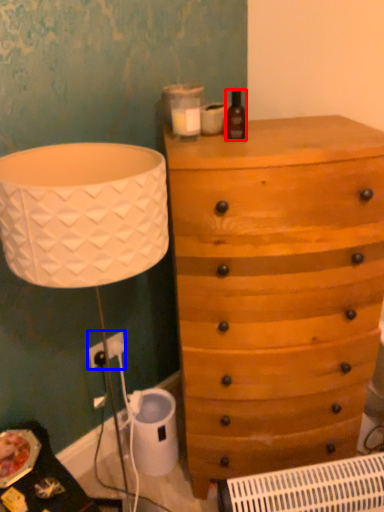
Question: Which of the following is the farthest to the observer, bottle (highlighted by a red box) or electric outlet (highlighted by a blue box)?

Choices:
 (A) bottle
 (B) electric outlet

Answer: (B)